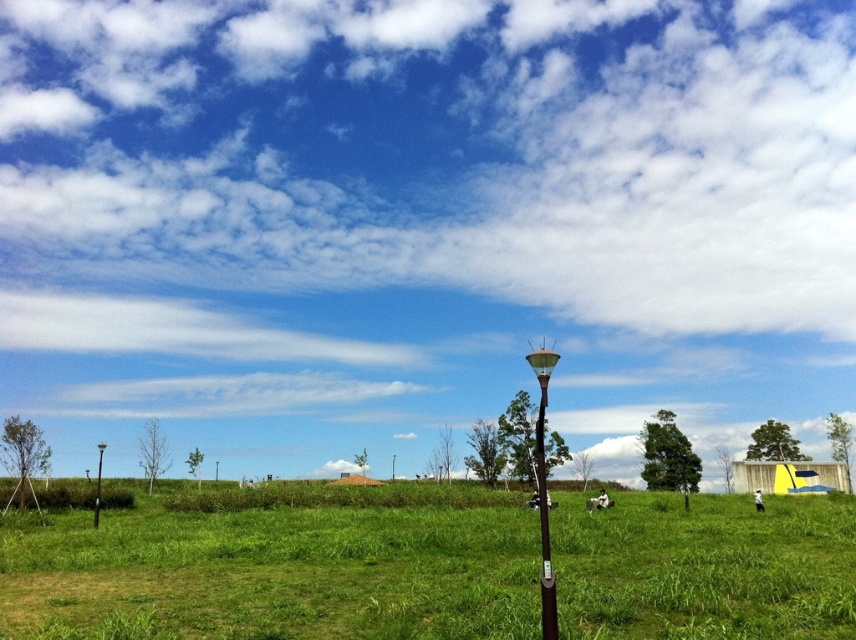
Who is positioned more to the right, metallic gray pole at center or metallic pole at left?

metallic gray pole at center

Between metallic gray pole at center and metallic pole at left, which one appears on the left side from the viewer's perspective?

metallic pole at left

Where is `metallic gray pole at center`? This screenshot has height=640, width=856. metallic gray pole at center is located at coordinates (544, 492).

Is green grass at center closer to camera compared to metallic gray pole at center?

No, green grass at center is further to the viewer.

Between point (837, 634) and point (548, 355), which one is positioned behind?

Positioned behind is point (837, 634).

Where is `green grass at center`? green grass at center is located at coordinates (272, 573).

Does green grass at center come in front of metallic pole at left?

Yes, green grass at center is closer to the viewer.

Does point (616, 636) come farther from viewer compared to point (100, 467)?

No.

You are a GUI agent. You are given a task and a screenshot of the screen. Output one action in this format:
    pyautogui.click(x=<x>, y=<y>)
    Task: Click on the green grass at center
    The height and width of the screenshot is (640, 856).
    Given the screenshot: What is the action you would take?
    pyautogui.click(x=272, y=573)